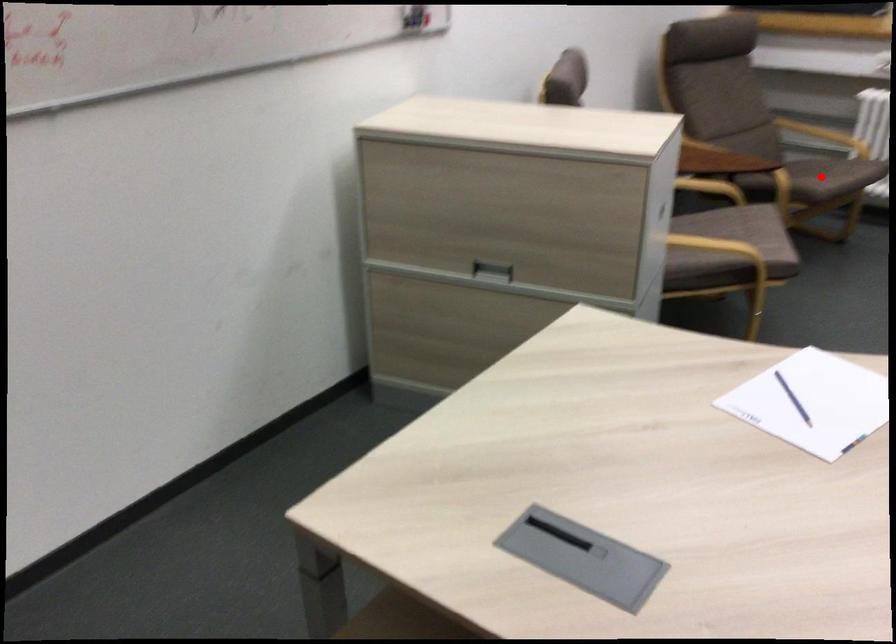
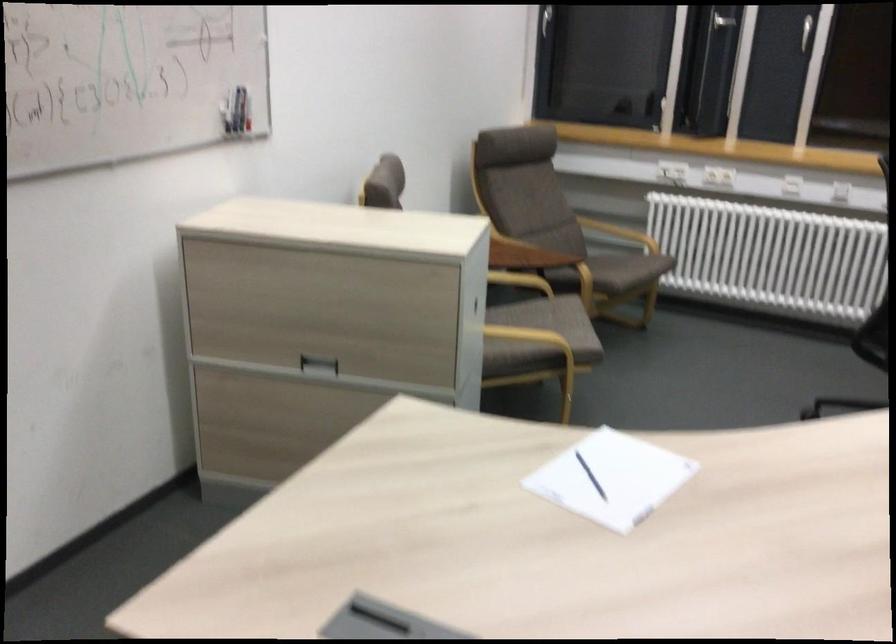
Question: I am providing you with two images of the same scene from different viewpoints. Given a red point in image1, look at the same physical point in image2. Is it:

Choices:
 (A) Closer to the viewpoint
 (B) Farther from the viewpoint

Answer: (B)